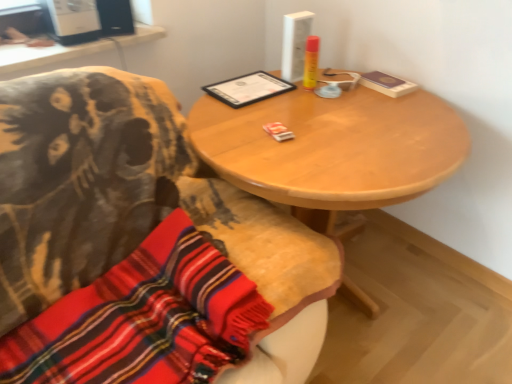
Question: Does wooden table at center have a lesser width compared to knitted wool scarf at lower left?

Choices:
 (A) yes
 (B) no

Answer: (B)

Question: Is wooden table at center further to the viewer compared to knitted wool scarf at lower left?

Choices:
 (A) no
 (B) yes

Answer: (B)

Question: From the image's perspective, is wooden table at center beneath knitted wool scarf at lower left?

Choices:
 (A) no
 (B) yes

Answer: (A)

Question: Is wooden table at center bigger than knitted wool scarf at lower left?

Choices:
 (A) yes
 (B) no

Answer: (A)

Question: Is wooden table at center at the right side of knitted wool scarf at lower left?

Choices:
 (A) yes
 (B) no

Answer: (A)

Question: From a real-world perspective, is white plastic computer desk at upper left physically located above or below knitted wool scarf at lower left?

Choices:
 (A) below
 (B) above

Answer: (B)

Question: From the image's perspective, is white plastic computer desk at upper left positioned above or below knitted wool scarf at lower left?

Choices:
 (A) below
 (B) above

Answer: (B)

Question: Choose the correct answer: Is white plastic computer desk at upper left inside knitted wool scarf at lower left or outside it?

Choices:
 (A) inside
 (B) outside

Answer: (B)

Question: Is white plastic computer desk at upper left taller or shorter than knitted wool scarf at lower left?

Choices:
 (A) short
 (B) tall

Answer: (A)

Question: Is point (237, 112) closer or farther from the camera than point (51, 62)?

Choices:
 (A) closer
 (B) farther

Answer: (A)

Question: From a real-world perspective, is wooden table at center physically located above or below white plastic computer desk at upper left?

Choices:
 (A) above
 (B) below

Answer: (B)

Question: In terms of height, does wooden table at center look taller or shorter compared to white plastic computer desk at upper left?

Choices:
 (A) short
 (B) tall

Answer: (B)

Question: Is wooden table at center spatially inside white plastic computer desk at upper left, or outside of it?

Choices:
 (A) inside
 (B) outside

Answer: (B)

Question: Is knitted wool scarf at lower left spatially inside white plastic computer desk at upper left, or outside of it?

Choices:
 (A) inside
 (B) outside

Answer: (B)

Question: Looking at the image, does knitted wool scarf at lower left seem bigger or smaller compared to white plastic computer desk at upper left?

Choices:
 (A) small
 (B) big

Answer: (B)